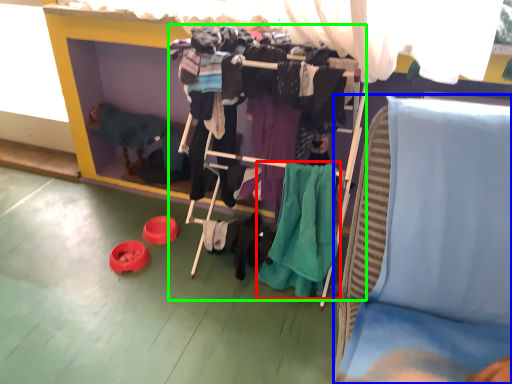
Question: Which object is positioned farthest from clothing (highlighted by a red box)? Select from furniture (highlighted by a blue box) and closet (highlighted by a green box).

Choices:
 (A) furniture
 (B) closet

Answer: (A)